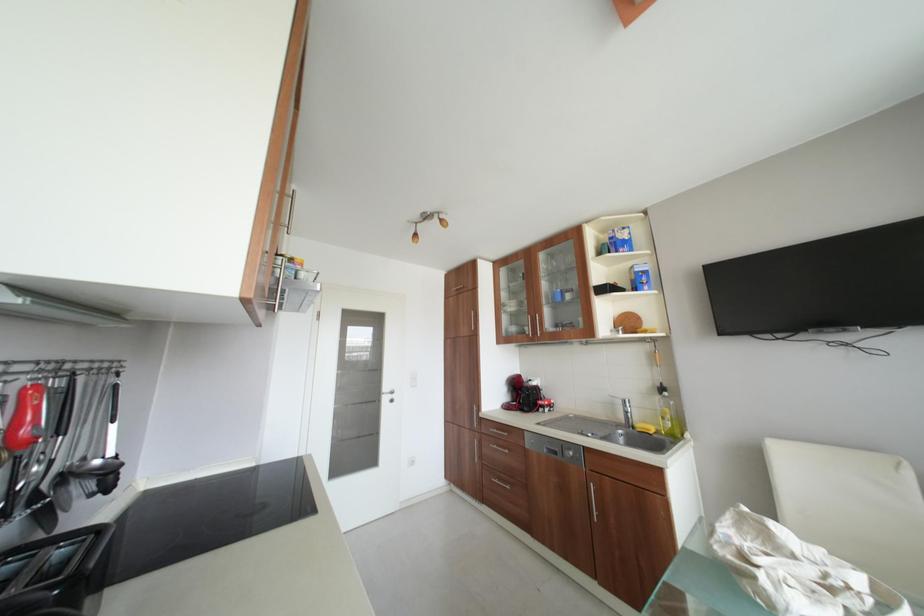
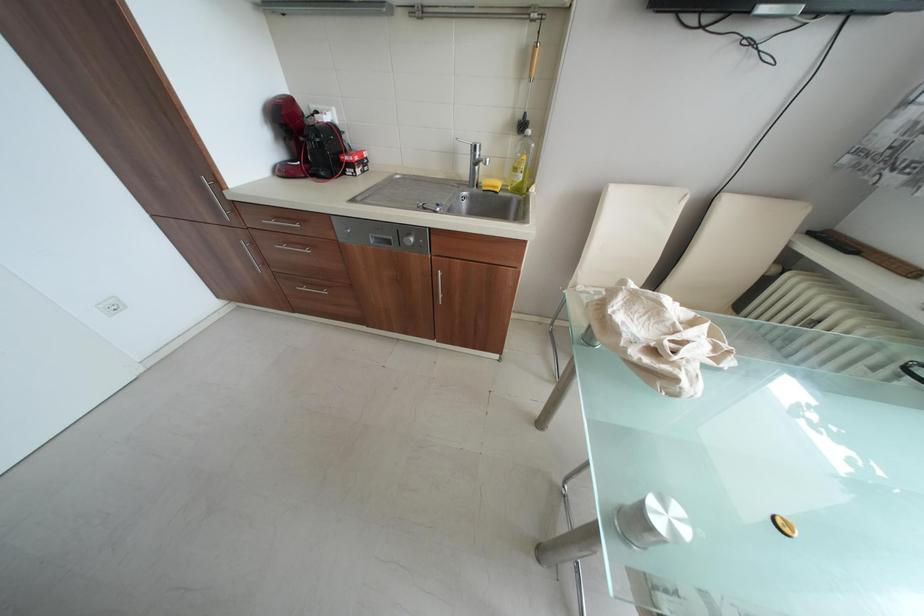
The first image is from the beginning of the video and the second image is from the end. How did the camera likely rotate when shooting the video?

The rotation direction of the camera is right-down.